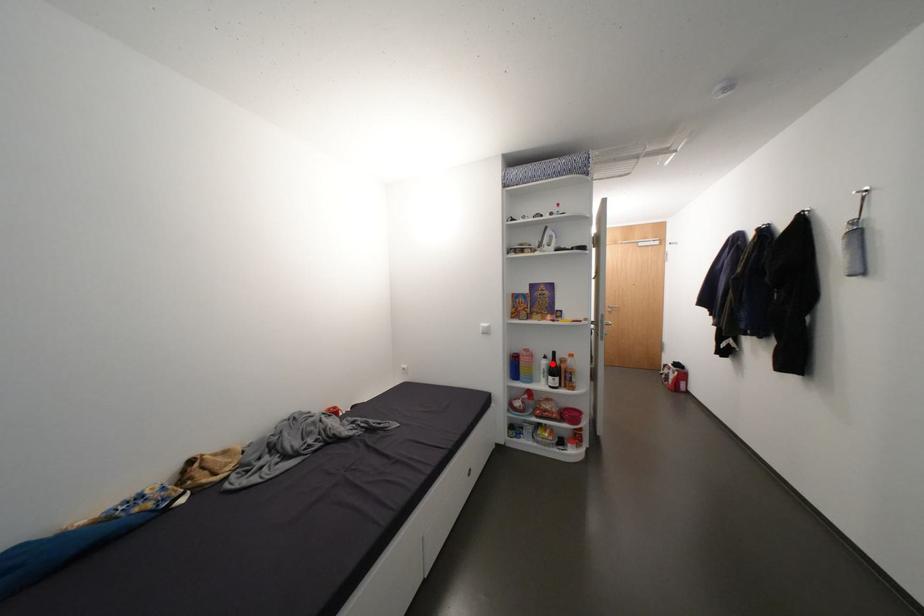
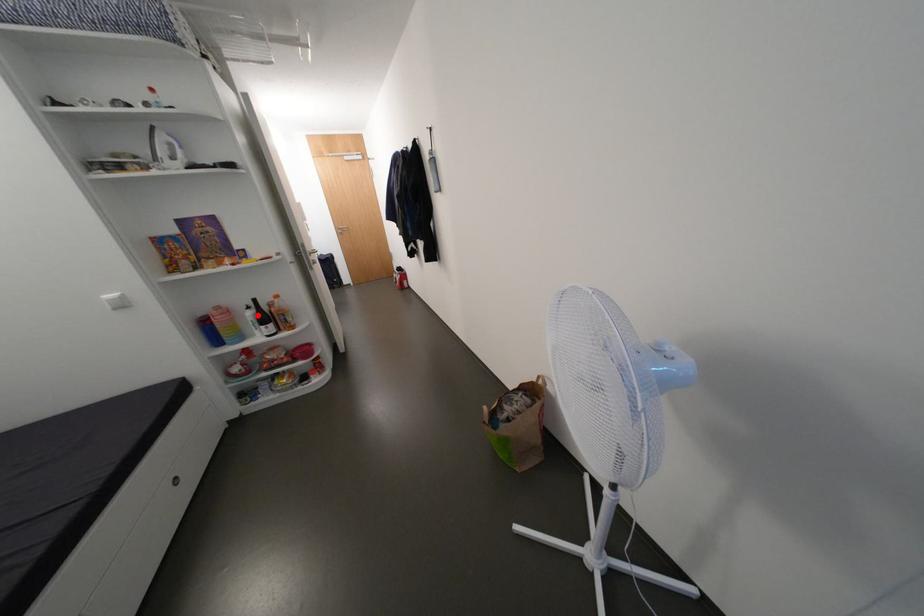
I am providing you with two images of the same scene from different viewpoints. A red point is marked on the first image and another point is marked on the second image. Do the highlighted points in image1 and image2 indicate the same real-world spot?

Yes